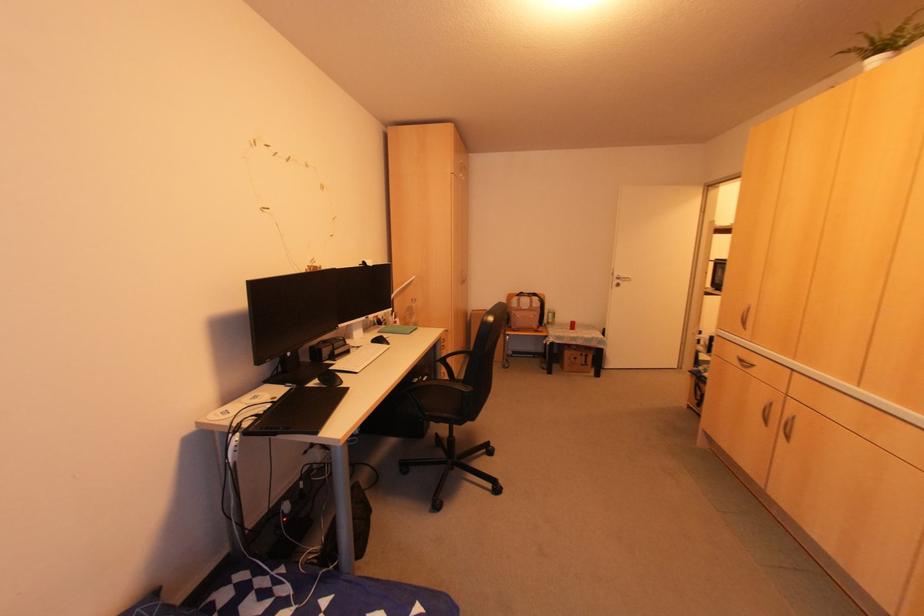
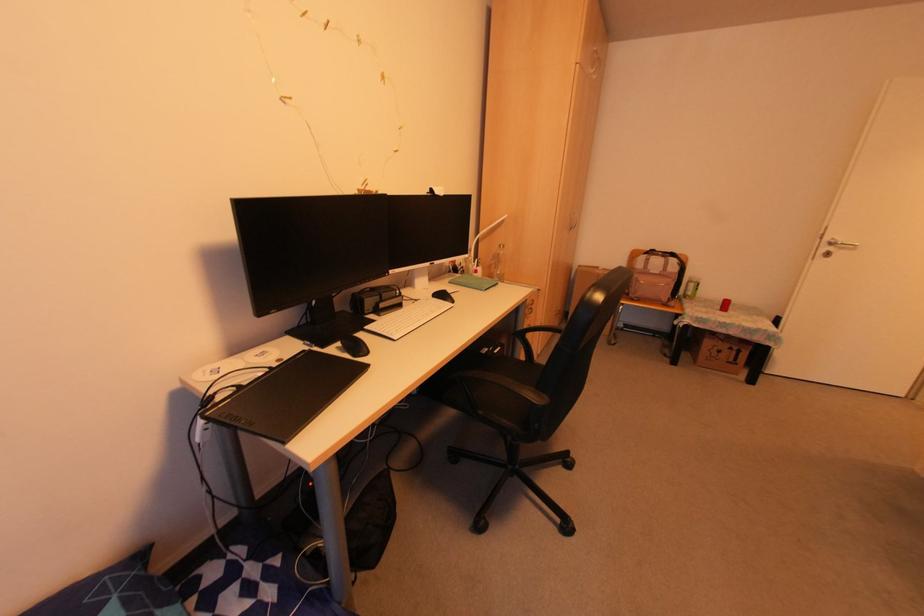
Locate, in the second image, the point that corresponds to [525,309] in the first image.

(655, 273)